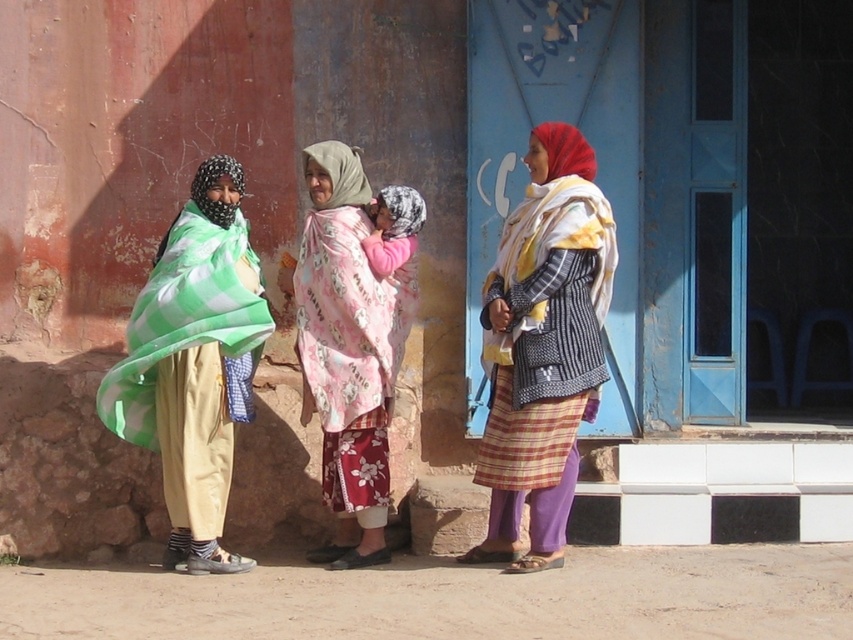
Question: Which point is closer to the camera?

Choices:
 (A) (207, 529)
 (B) (543, 228)
 (C) (320, 422)

Answer: (B)

Question: Can you confirm if green checkered scarf at left is thinner than pink floral scarf at center?

Choices:
 (A) no
 (B) yes

Answer: (A)

Question: Does striped woolen sweater at center have a lesser width compared to pink floral scarf at center?

Choices:
 (A) no
 (B) yes

Answer: (A)

Question: Based on their relative distances, which object is farther from the striped woolen sweater at center?

Choices:
 (A) pink floral scarf at center
 (B) green checkered scarf at left

Answer: (B)

Question: Can you confirm if striped woolen sweater at center is positioned below pink floral scarf at center?

Choices:
 (A) no
 (B) yes

Answer: (A)

Question: Which of these objects is positioned farthest from the pink floral scarf at center?

Choices:
 (A) striped woolen sweater at center
 (B) green checkered scarf at left

Answer: (A)